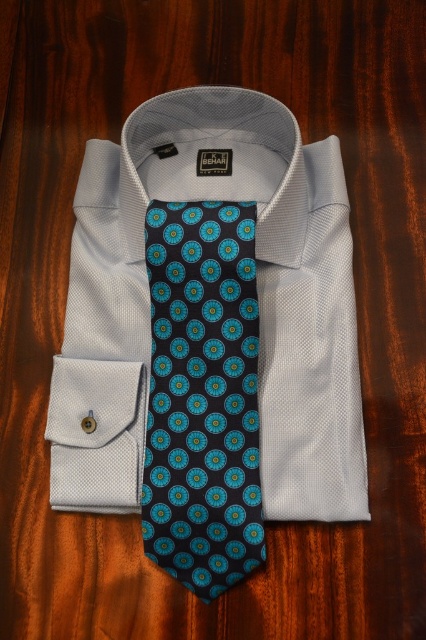
You are organizing a closet and need to place the white textured dress shirt at center and the dark blue silk tie at center in a drawer. If the drawer has a divider that separates items into left and right sections, which side should each item go to ensure they are placed according to their position in the image?

The white textured dress shirt at center should be placed in the right section and the dark blue silk tie at center in the left section because the white textured dress shirt at center is to the right of the dark blue silk tie at center in the image.

You are standing 1.2 meters away from the wooden table where the light gray dress shirt and patterned tie are placed. There is a point at coordinates point (141,138). Can you reach that point without moving closer to the table?

The distance of point (141,138) from viewer is 1.35 meters. Since you are standing 1.2 meters away from the table, you cannot reach the point as it is further away from you than your current position.